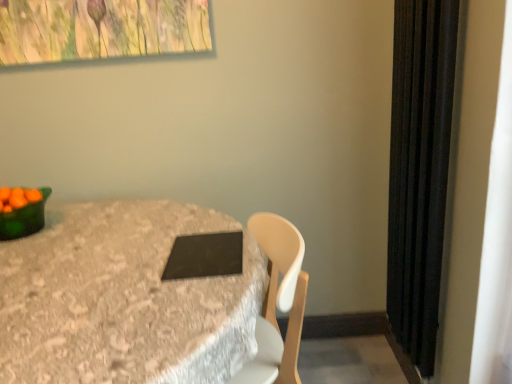
What is the approximate height of matte black tablet at center?

31.88 inches.

What do you see at coordinates (205, 256) in the screenshot? I see `black matte pad at center` at bounding box center [205, 256].

What do you see at coordinates (18, 198) in the screenshot?
I see `green matte bowl at left` at bounding box center [18, 198].

Locate an element on the screen. The width and height of the screenshot is (512, 384). green glossy bowl at left is located at coordinates (24, 219).

Who is smaller, matte black tablet at center or green glossy bowl at left?

With smaller size is green glossy bowl at left.

Considering the sizes of objects matte black tablet at center and green glossy bowl at left in the image provided, who is wider, matte black tablet at center or green glossy bowl at left?

With larger width is matte black tablet at center.

Looking at this image, how different are the orientations of matte black tablet at center and green glossy bowl at left in degrees?

There is a 4.74-degree angle between the facing directions of matte black tablet at center and green glossy bowl at left.

Are matte black tablet at center and green glossy bowl at left located far from each other?

No, matte black tablet at center is in close proximity to green glossy bowl at left.

Identify the location of bowl that appears above the black matte pad at center (from the image's perspective). (24, 219).

Is point (231, 235) positioned behind point (39, 221)?

No.

From a real-world perspective, is black matte pad at center on top of green glossy bowl at left?

No, from a real-world perspective, black matte pad at center is not above green glossy bowl at left.

Between black matte pad at center and green glossy bowl at left, which one appears on the right side from the viewer's perspective?

From the viewer's perspective, black matte pad at center appears more on the right side.

Looking at this image, from a real-world perspective, who is located lower, green glossy bowl at left or matte black tablet at center?

In real-world perspective, matte black tablet at center is lower.

Is point (44, 220) farther from camera compared to point (238, 312)?

Yes, point (44, 220) is behind point (238, 312).

Which object is further away from the camera, green glossy bowl at left or matte black tablet at center?

green glossy bowl at left is further away from the camera.

Measure the distance from green glossy bowl at left to matte black tablet at center.

A distance of 16.53 inches exists between green glossy bowl at left and matte black tablet at center.

Consider the image. Does matte black tablet at center come behind green matte bowl at left?

No, the depth of matte black tablet at center is less than that of green matte bowl at left.

Is matte black tablet at center to the left or to the right of green matte bowl at left in the image?

Based on their positions, matte black tablet at center is located to the right of green matte bowl at left.

Considering the relative sizes of matte black tablet at center and green matte bowl at left in the image provided, is matte black tablet at center taller than green matte bowl at left?

Correct, matte black tablet at center is much taller as green matte bowl at left.

Based on their positions, is black matte pad at center located to the left or right of matte black tablet at center?

Based on their positions, black matte pad at center is located to the right of matte black tablet at center.

Between black matte pad at center and matte black tablet at center, which one has smaller size?

black matte pad at center.

Is the surface of black matte pad at center in direct contact with matte black tablet at center?

No, black matte pad at center is not next to matte black tablet at center.

Is black matte pad at center oriented away from matte black tablet at center?

Correct, black matte pad at center is looking away from matte black tablet at center.

Who is more distant, green matte bowl at left or black matte pad at center?

green matte bowl at left is further from the camera.

Is green matte bowl at left not inside black matte pad at center?

Yes, green matte bowl at left is not within black matte pad at center.

How different are the orientations of green matte bowl at left and black matte pad at center in degrees?

There is a 87.3-degree angle between the facing directions of green matte bowl at left and black matte pad at center.

Can you confirm if green matte bowl at left is bigger than black matte pad at center?

Incorrect, green matte bowl at left is not larger than black matte pad at center.

Relative to green matte bowl at left, is black matte pad at center in front or behind?

black matte pad at center is in front of green matte bowl at left.

Is black matte pad at center looking in the opposite direction of green matte bowl at left?

No, green matte bowl at left is not at the back of black matte pad at center.

Does black matte pad at center have a smaller size compared to green matte bowl at left?

No.

Which object is positioned more to the right, black matte pad at center or green matte bowl at left?

From the viewer's perspective, black matte pad at center appears more on the right side.

Identify the location of bowl on the left of matte black tablet at center. (24, 219).

Locate an element on the screen. This screenshot has width=512, height=384. bowl that is above the black matte pad at center (from a real-world perspective) is located at coordinates (24, 219).

Which object lies nearer to the anchor point black matte pad at center, matte black tablet at center or green glossy bowl at left?

The object closer to black matte pad at center is matte black tablet at center.

Estimate the real-world distances between objects in this image. Which object is further from matte black tablet at center, green matte bowl at left or green glossy bowl at left?

Among the two, green matte bowl at left is located further to matte black tablet at center.

Estimate the real-world distances between objects in this image. Which object is further from green matte bowl at left, green glossy bowl at left or matte black tablet at center?

matte black tablet at center lies further to green matte bowl at left than the other object.

From the image, which object appears to be nearer to matte black tablet at center, green glossy bowl at left or black matte pad at center?

Based on the image, black matte pad at center appears to be nearer to matte black tablet at center.

From the image, which object appears to be farther from matte black tablet at center, green glossy bowl at left or green matte bowl at left?

The object further to matte black tablet at center is green matte bowl at left.

Looking at the image, which one is located closer to matte black tablet at center, black matte pad at center or green glossy bowl at left?

black matte pad at center is positioned closer to the anchor matte black tablet at center.

Which object lies nearer to the anchor point green glossy bowl at left, matte black tablet at center or green matte bowl at left?

green matte bowl at left is positioned closer to the anchor green glossy bowl at left.

From the image, which object appears to be nearer to green glossy bowl at left, matte black tablet at center or black matte pad at center?

matte black tablet at center lies closer to green glossy bowl at left than the other object.

Find the location of a particular element. fruit located between green glossy bowl at left and black matte pad at center in the left-right direction is located at coordinates [18, 198].

What are the coordinates of `table between green glossy bowl at left and black matte pad at center from left to right` in the screenshot? It's located at (123, 299).

Find the location of a particular element. This screenshot has width=512, height=384. fruit between matte black tablet at center and green glossy bowl at left along the z-axis is located at coordinates (18, 198).

The width and height of the screenshot is (512, 384). Identify the location of pad between matte black tablet at center and green matte bowl at left in the front-back direction. (205, 256).